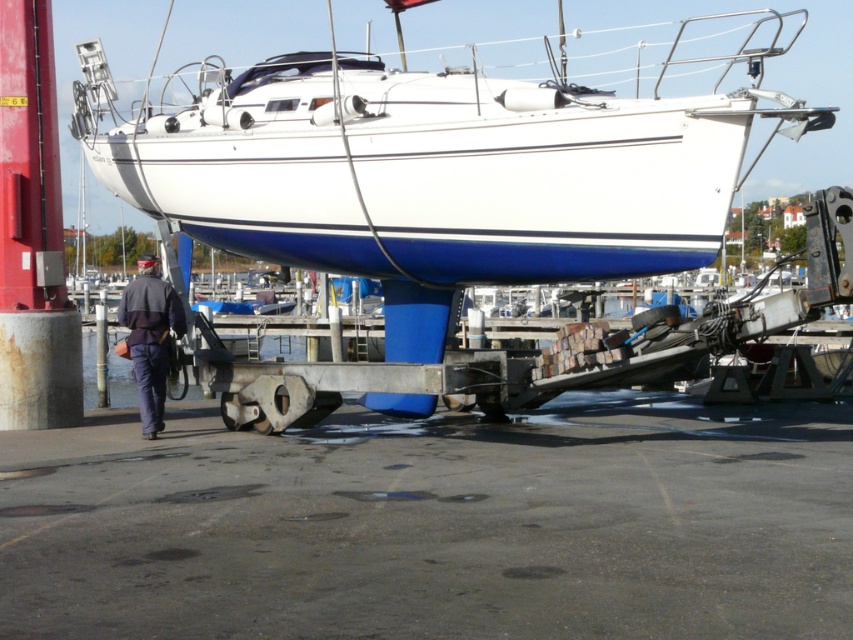
Is white glossy boat at center to the right of dark blue uniform at lower left from the viewer's perspective?

Yes, white glossy boat at center is to the right of dark blue uniform at lower left.

Is white glossy boat at center thinner than dark blue uniform at lower left?

Incorrect, white glossy boat at center's width is not less than dark blue uniform at lower left's.

Who is more forward, (693, 99) or (164, 288)?

Point (693, 99) is in front.

Identify the location of white glossy boat at center. The height and width of the screenshot is (640, 853). (440, 163).